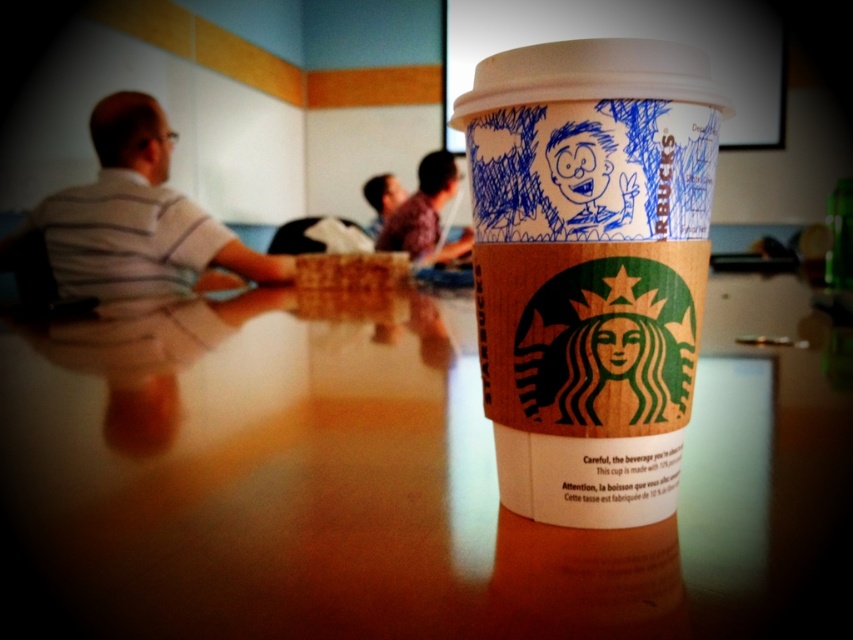
Can you confirm if wooden table at center is shorter than brown paper cup at center?

Correct, wooden table at center is not as tall as brown paper cup at center.

Is wooden table at center above brown paper cup at center?

No.

Who is more forward, (747, 348) or (618, 108)?

Point (618, 108) is in front.

In order to click on wooden table at center in this screenshot , I will do coord(399,483).

Consider the image. Is brown paper cup at center smaller than striped shirt at left?

Indeed, brown paper cup at center has a smaller size compared to striped shirt at left.

Is brown paper cup at center bigger than striped shirt at left?

Incorrect, brown paper cup at center is not larger than striped shirt at left.

Between point (590, 102) and point (161, 196), which one is positioned in front?

Point (590, 102) is more forward.

Locate an element on the screen. The image size is (853, 640). brown paper cup at center is located at coordinates (590, 268).

Does wooden table at center have a lesser height compared to plaid shirt at center?

Indeed, wooden table at center has a lesser height compared to plaid shirt at center.

Does wooden table at center appear under plaid shirt at center?

Correct, wooden table at center is located below plaid shirt at center.

Between point (793, 454) and point (421, 176), which one is positioned in front?

Point (793, 454)

The width and height of the screenshot is (853, 640). In order to click on wooden table at center in this screenshot , I will do `click(399, 483)`.